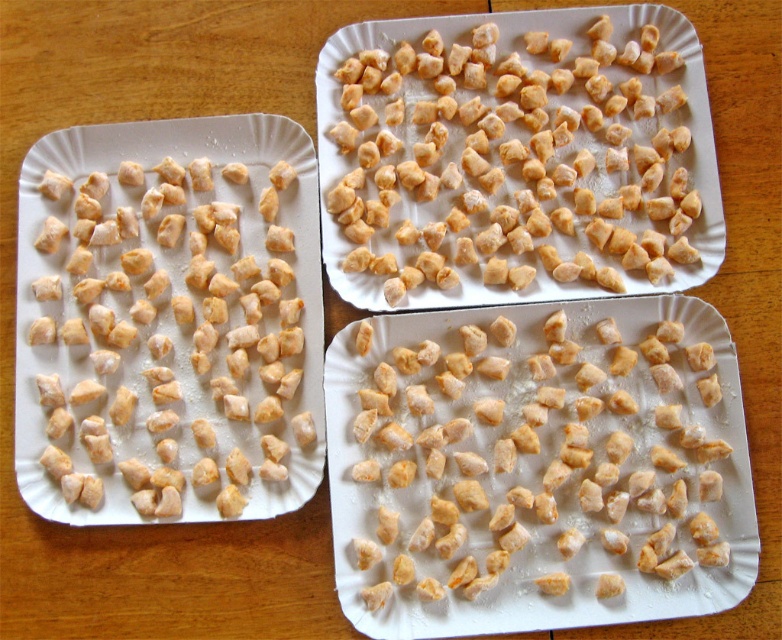
You have two items on the table, the golden brown croutons at center and the light brown dough at left. Which one has a larger width?

The golden brown croutons at center might be wider than light brown dough at left according to the description.

You are a food critic evaluating these snacks. You notice two main components on the plates. Which component is smaller in size between the golden brown crumbly at center and the light brown dough at left?

The golden brown crumbly at center is smaller than the light brown dough at left.